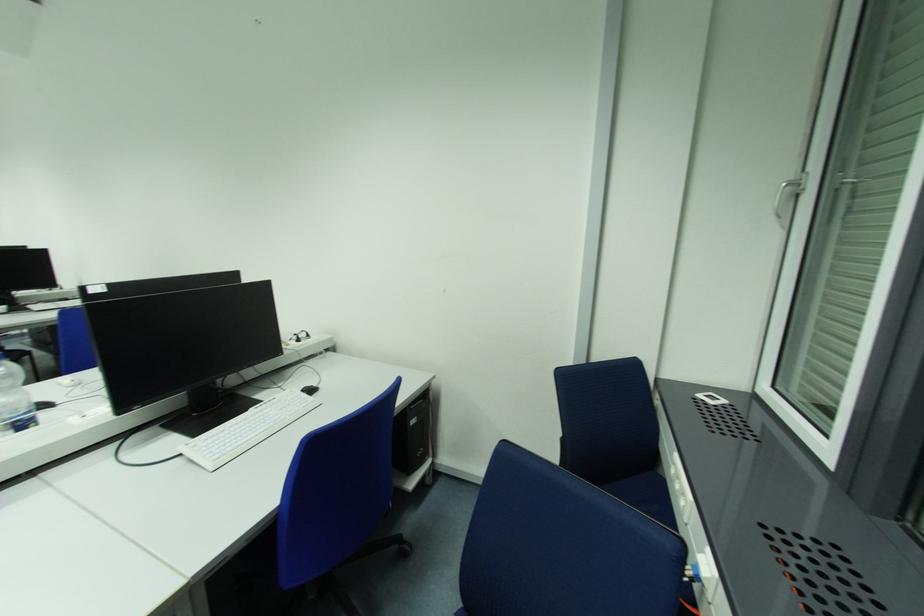
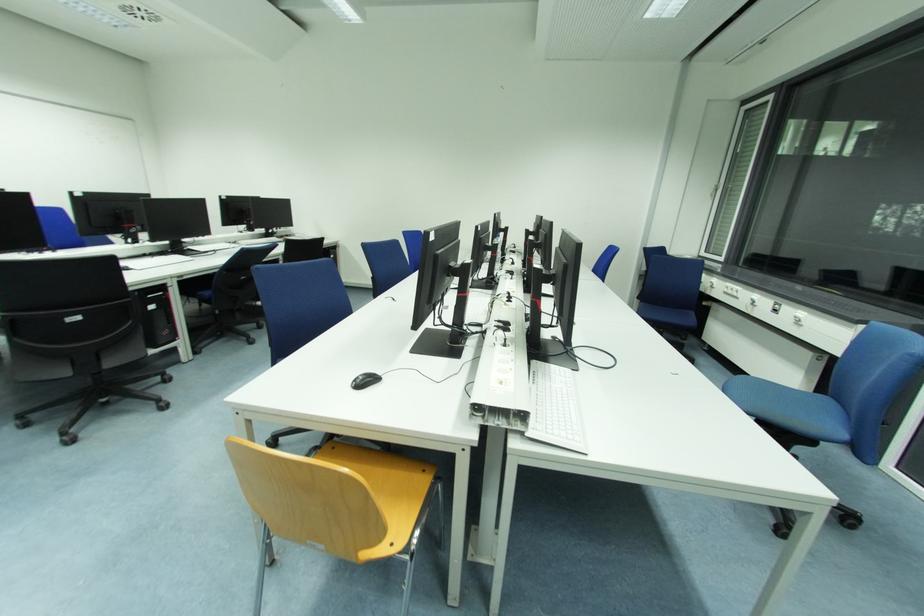
Based on the photo, which direction would the cameraman need to move to produce the second image?

The cameraman walked toward left, backward.